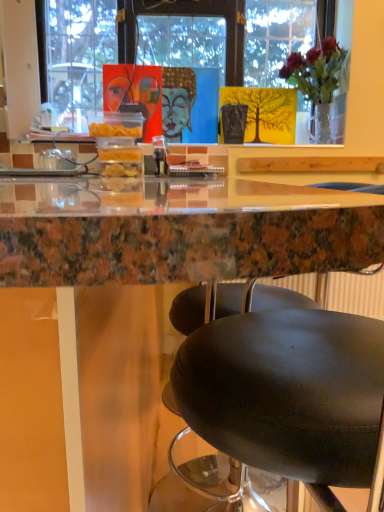
Where is `translucent glass vase at upper right`? This screenshot has width=384, height=512. translucent glass vase at upper right is located at coordinates (317, 81).

This screenshot has height=512, width=384. What do you see at coordinates (317, 81) in the screenshot?
I see `translucent glass vase at upper right` at bounding box center [317, 81].

Describe the element at coordinates (202, 226) in the screenshot. This screenshot has width=384, height=512. I see `marble table at center` at that location.

Find the location of a particular element. marble table at center is located at coordinates (202, 226).

Where is `translucent glass vase at upper right`? The image size is (384, 512). translucent glass vase at upper right is located at coordinates (317, 81).

Does translucent glass vase at upper right appear on the left side of marble table at center?

No.

Which is behind, translucent glass vase at upper right or marble table at center?

Positioned behind is translucent glass vase at upper right.

Is point (326, 93) closer or farther from the camera than point (353, 257)?

Point (326, 93) appears to be farther away from the viewer than point (353, 257).

Looking at this image, from the image's perspective, which is above, translucent glass vase at upper right or marble table at center?

From the image's view, translucent glass vase at upper right is above.

In the scene shown: From a real-world perspective, relative to marble table at center, is translucent glass vase at upper right vertically above or below?

From a real-world perspective, translucent glass vase at upper right is physically above marble table at center.

Can you confirm if translucent glass vase at upper right is wider than marble table at center?

In fact, translucent glass vase at upper right might be narrower than marble table at center.

Considering the sizes of objects translucent glass vase at upper right and marble table at center in the image provided, who is taller, translucent glass vase at upper right or marble table at center?

marble table at center is taller.

Based on the photo, who is bigger, translucent glass vase at upper right or marble table at center?

marble table at center.

Is translucent glass vase at upper right situated inside marble table at center or outside?

translucent glass vase at upper right cannot be found inside marble table at center.

Are translucent glass vase at upper right and marble table at center located far from each other?

Indeed, translucent glass vase at upper right is not near marble table at center.

Is translucent glass vase at upper right looking in the opposite direction of marble table at center?

translucent glass vase at upper right does not have its back to marble table at center.

How many degrees apart are the facing directions of translucent glass vase at upper right and marble table at center?

They differ by 91.6 degrees in their facing directions.

Where is `table in front of the translucent glass vase at upper right`? The width and height of the screenshot is (384, 512). table in front of the translucent glass vase at upper right is located at coordinates (202, 226).

Which is more to the left, marble table at center or translucent glass vase at upper right?

Positioned to the left is marble table at center.

Which object is closer to the camera taking this photo, marble table at center or translucent glass vase at upper right?

marble table at center is in front.

Which point is more distant from viewer, [38,415] or [327,95]?

The point [327,95] is farther.

From the image's perspective, is marble table at center positioned above or below translucent glass vase at upper right?

marble table at center is situated lower than translucent glass vase at upper right in the image.

From a real-world perspective, which is physically above, marble table at center or translucent glass vase at upper right?

translucent glass vase at upper right.

Is marble table at center wider or thinner than translucent glass vase at upper right?

Clearly, marble table at center has more width compared to translucent glass vase at upper right.

Does marble table at center have a lesser height compared to translucent glass vase at upper right?

No.

Who is bigger, marble table at center or translucent glass vase at upper right?

With larger size is marble table at center.

Is marble table at center inside the boundaries of translucent glass vase at upper right, or outside?

marble table at center is outside translucent glass vase at upper right.

Are marble table at center and translucent glass vase at upper right beside each other?

marble table at center is not next to translucent glass vase at upper right, and they're not touching.

Is marble table at center facing away from translucent glass vase at upper right?

marble table at center does not have its back to translucent glass vase at upper right.

In the scene shown: How far apart are marble table at center and translucent glass vase at upper right?

marble table at center is 1.70 meters from translucent glass vase at upper right.

Locate an element on the screen. table below the translucent glass vase at upper right (from the image's perspective) is located at coordinates (202, 226).

At what (x,y) coordinates should I click in order to perform the action: click on houseplant lying behind the marble table at center. Please return your answer as a coordinate pair (x, y). Looking at the image, I should click on (317, 81).

In order to click on table below the translucent glass vase at upper right (from the image's perspective) in this screenshot , I will do `click(202, 226)`.